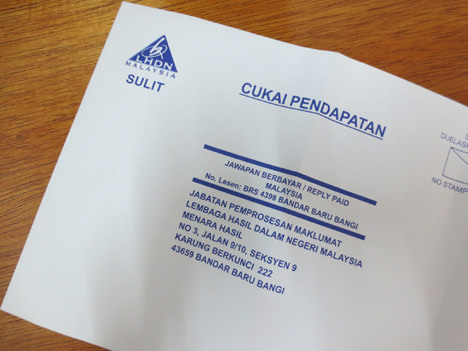
What are the coordinates of `table` in the screenshot? It's located at (34, 107).